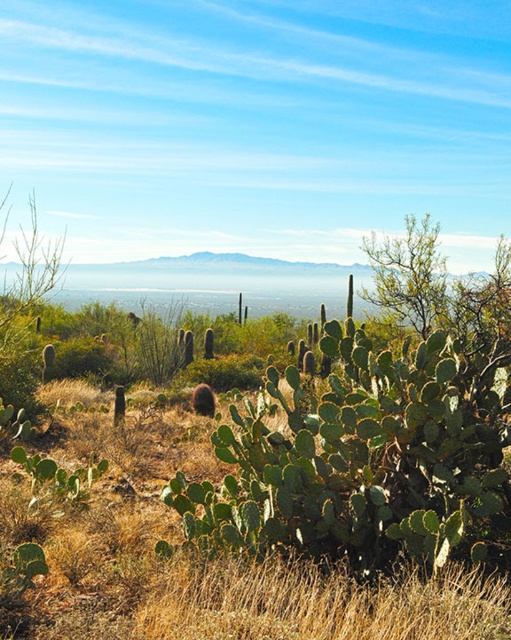
Is green spiny cactus at center to the right of green leafy grass at center from the viewer's perspective?

Indeed, green spiny cactus at center is positioned on the right side of green leafy grass at center.

In the scene shown: Who is positioned more to the left, green spiny cactus at center or green leafy grass at center?

Positioned to the left is green leafy grass at center.

Where is `green spiny cactus at center`? The width and height of the screenshot is (511, 640). green spiny cactus at center is located at coordinates (368, 458).